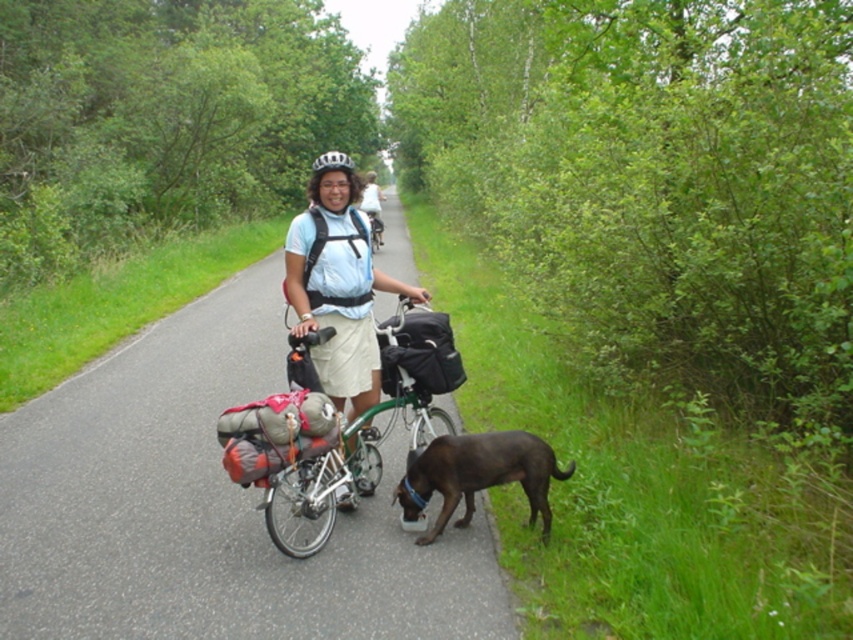
Question: Does green asphalt road at center appear over matte white shirt at center?

Choices:
 (A) yes
 (B) no

Answer: (B)

Question: Does green asphalt road at center appear on the left side of white matte bicycle helmet at center?

Choices:
 (A) no
 (B) yes

Answer: (A)

Question: Which point is farther to the camera?

Choices:
 (A) (109, 584)
 (B) (329, 168)
 (C) (328, 218)

Answer: (C)

Question: Which object is the farthest from the matte white shirt at center?

Choices:
 (A) white matte bicycle helmet at center
 (B) silver metallic bicycle at center
 (C) green asphalt road at center

Answer: (A)

Question: Which of the following is the farthest from the observer?

Choices:
 (A) (373, 212)
 (B) (440, 518)
 (C) (415, 376)

Answer: (A)

Question: Is silver metallic bicycle at center in front of matte white shirt at center?

Choices:
 (A) no
 (B) yes

Answer: (B)